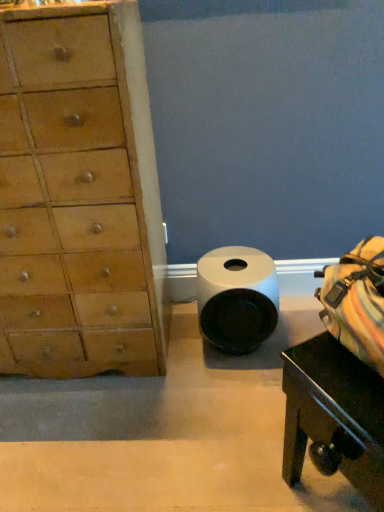
Question: Is black glossy table at lower right closer to camera compared to white matte toilet paper at center?

Choices:
 (A) yes
 (B) no

Answer: (A)

Question: Is black glossy table at lower right with white matte toilet paper at center?

Choices:
 (A) no
 (B) yes

Answer: (A)

Question: Is black glossy table at lower right positioned beyond the bounds of white matte toilet paper at center?

Choices:
 (A) yes
 (B) no

Answer: (A)

Question: From a real-world perspective, is black glossy table at lower right over white matte toilet paper at center?

Choices:
 (A) no
 (B) yes

Answer: (B)

Question: From the image's perspective, is black glossy table at lower right located beneath white matte toilet paper at center?

Choices:
 (A) yes
 (B) no

Answer: (A)

Question: From a real-world perspective, does black glossy table at lower right sit lower than white matte toilet paper at center?

Choices:
 (A) no
 (B) yes

Answer: (A)

Question: Can we say light brown wood chest of drawers at left lies outside black glossy table at lower right?

Choices:
 (A) yes
 (B) no

Answer: (A)

Question: Is light brown wood chest of drawers at left not near black glossy table at lower right?

Choices:
 (A) no
 (B) yes

Answer: (A)

Question: From the image's perspective, is light brown wood chest of drawers at left on black glossy table at lower right?

Choices:
 (A) yes
 (B) no

Answer: (A)

Question: From a real-world perspective, is light brown wood chest of drawers at left below black glossy table at lower right?

Choices:
 (A) yes
 (B) no

Answer: (B)

Question: From the image's perspective, is light brown wood chest of drawers at left located beneath black glossy table at lower right?

Choices:
 (A) no
 (B) yes

Answer: (A)

Question: Is light brown wood chest of drawers at left facing away from black glossy table at lower right?

Choices:
 (A) no
 (B) yes

Answer: (A)

Question: Is light brown wood chest of drawers at left surrounding white matte toilet paper at center?

Choices:
 (A) yes
 (B) no

Answer: (B)